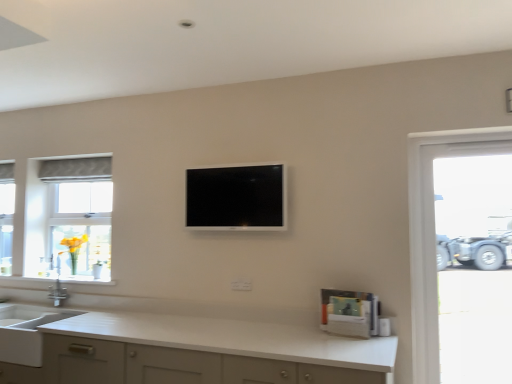
You are a GUI agent. You are given a task and a screenshot of the screen. Output one action in this format:
    pyautogui.click(x=<x>, y=<y>)
    Task: Click on the black glossy tv at center
    The image size is (512, 384).
    Given the screenshot: What is the action you would take?
    pyautogui.click(x=237, y=197)

You are a GUI agent. You are given a task and a screenshot of the screen. Output one action in this format:
    pyautogui.click(x=<x>, y=<y>)
    Task: Click on the yellow glass vase at left
    This screenshot has width=512, height=384.
    Given the screenshot: What is the action you would take?
    pyautogui.click(x=74, y=249)

You are a GUI agent. You are given a task and a screenshot of the screen. Output one action in this format:
    pyautogui.click(x=<x>, y=<y>)
    Task: Click on the silver metallic faucet at left
    Image resolution: width=512 pixels, height=384 pixels.
    Given the screenshot: What is the action you would take?
    pyautogui.click(x=47, y=263)

This screenshot has height=384, width=512. In order to click on transparent glass door at right in this screenshot , I will do `click(423, 228)`.

Which object is wider, yellow glass vase at left or white matte sink at lower left?

white matte sink at lower left.

Is yellow glass vase at left surrounding white matte sink at lower left?

No.

From the image's perspective, would you say yellow glass vase at left is positioned over white matte sink at lower left?

Yes.

Does yellow glass vase at left have a smaller size compared to white matte sink at lower left?

Indeed, yellow glass vase at left has a smaller size compared to white matte sink at lower left.

Between silver metallic faucet at left and white matte sink at lower left, which one has smaller width?

Thinner between the two is silver metallic faucet at left.

In the image, there is a silver metallic faucet at left. Where is `sink below it (from the image's perspective)`? Image resolution: width=512 pixels, height=384 pixels. sink below it (from the image's perspective) is located at coordinates (26, 331).

Considering the relative sizes of silver metallic faucet at left and white matte sink at lower left in the image provided, is silver metallic faucet at left smaller than white matte sink at lower left?

Correct, silver metallic faucet at left occupies less space than white matte sink at lower left.

Is point (52, 261) positioned in front of point (5, 330)?

No.

Based on the photo, can you confirm if white matte sink at lower left is shorter than matte gray fabric at left?

Yes, white matte sink at lower left is shorter than matte gray fabric at left.

Between point (8, 341) and point (110, 252), which one is positioned in front?

Positioned in front is point (8, 341).

Would you say white matte sink at lower left is outside matte gray fabric at left?

white matte sink at lower left lies outside matte gray fabric at left's area.

Does white matte sink at lower left have a smaller size compared to matte gray fabric at left?

No.

Can you tell me how much yellow glass vase at left and black glossy tv at center differ in facing direction?

4.99 degrees.

Which of these two, yellow glass vase at left or black glossy tv at center, stands taller?

With more height is black glossy tv at center.

Is black glossy tv at center a part of yellow glass vase at left?

No, yellow glass vase at left does not contain black glossy tv at center.

From a real-world perspective, which is physically above, yellow glass vase at left or black glossy tv at center?

In real-world perspective, black glossy tv at center is above.

Based on the photo, are white matte sink at lower left and silver metallic faucet at left located far from each other?

No, there isn't a large distance between white matte sink at lower left and silver metallic faucet at left.

Considering the relative sizes of white matte sink at lower left and silver metallic faucet at left in the image provided, is white matte sink at lower left shorter than silver metallic faucet at left?

No.

The image size is (512, 384). I want to click on faucet that appears above the white matte sink at lower left (from the image's perspective), so click(47, 263).

From the image's perspective, is white matte sink at lower left located above silver metallic faucet at left?

Incorrect, from the image's perspective, white matte sink at lower left is lower than silver metallic faucet at left.

From a real-world perspective, is black glossy tv at center located beneath matte gray fabric at left?

No.

Can you tell me how much black glossy tv at center and matte gray fabric at left differ in facing direction?

There is a 0.972-degree angle between the facing directions of black glossy tv at center and matte gray fabric at left.

Can you confirm if black glossy tv at center is shorter than matte gray fabric at left?

Correct, black glossy tv at center is not as tall as matte gray fabric at left.

Consider the image. Which object is wider, black glossy tv at center or matte gray fabric at left?

With larger width is matte gray fabric at left.

Looking at this image, what's the angular difference between transparent glass door at right and black glossy tv at center's facing directions?

1.75 degrees.

Considering the relative positions of transparent glass door at right and black glossy tv at center in the image provided, is transparent glass door at right to the left of black glossy tv at center from the viewer's perspective?

Incorrect, transparent glass door at right is not on the left side of black glossy tv at center.

Does point (411, 201) come in front of point (257, 190)?

Yes, point (411, 201) is in front of point (257, 190).

Where is `flower above the white matte sink at lower left (from the image's perspective)`? The width and height of the screenshot is (512, 384). flower above the white matte sink at lower left (from the image's perspective) is located at coordinates (74, 249).

This screenshot has height=384, width=512. In order to click on sink below the silver metallic faucet at left (from a real-world perspective) in this screenshot , I will do `click(26, 331)`.

Considering their positions, is white matte countertop at lower center positioned closer to black glossy tv at center than transparent glass door at right?

white matte countertop at lower center lies closer to black glossy tv at center than the other object.

Which object lies nearer to the anchor point black glossy tv at center, yellow glass vase at left or white matte sink at lower left?

white matte sink at lower left lies closer to black glossy tv at center than the other object.

When comparing their distances from silver metallic faucet at left, does white matte sink at lower left or matte gray fabric at left seem closer?

matte gray fabric at left is closer to silver metallic faucet at left.

Considering their positions, is transparent glass door at right positioned closer to white matte sink at lower left than silver metallic faucet at left?

Among the two, silver metallic faucet at left is located nearer to white matte sink at lower left.

When comparing their distances from transparent glass door at right, does matte gray fabric at left or yellow glass vase at left seem closer?

The object closer to transparent glass door at right is matte gray fabric at left.

Consider the image. When comparing their distances from white matte sink at lower left, does yellow glass vase at left or white matte countertop at lower center seem closer?

yellow glass vase at left.

Considering their positions, is yellow glass vase at left positioned closer to silver metallic faucet at left than white matte countertop at lower center?

yellow glass vase at left.

Considering their positions, is transparent glass door at right positioned further to white matte sink at lower left than matte gray fabric at left?

Among the two, transparent glass door at right is located further to white matte sink at lower left.

Identify the location of sink located between white matte countertop at lower center and yellow glass vase at left in the depth direction. The image size is (512, 384). (26, 331).

Identify the location of television positioned between white matte countertop at lower center and yellow glass vase at left from near to far. This screenshot has height=384, width=512. (237, 197).

Where is `television located between matte gray fabric at left and transparent glass door at right in the left-right direction`? This screenshot has width=512, height=384. television located between matte gray fabric at left and transparent glass door at right in the left-right direction is located at coordinates (237, 197).

The width and height of the screenshot is (512, 384). Find the location of `bay window between white matte countertop at lower center and silver metallic faucet at left from front to back`. bay window between white matte countertop at lower center and silver metallic faucet at left from front to back is located at coordinates (81, 227).